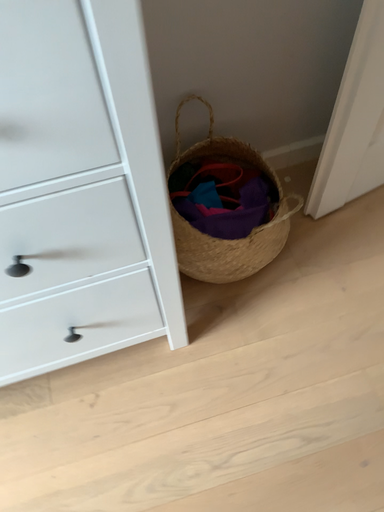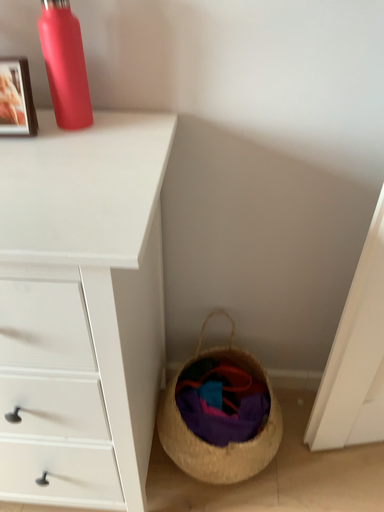
Question: Which way did the camera rotate in the video?

Choices:
 (A) rotated left
 (B) rotated right

Answer: (A)